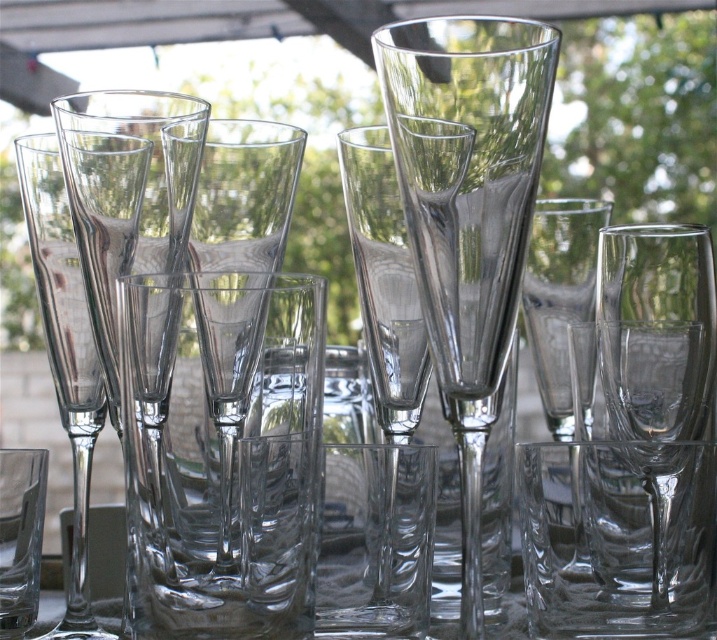
Question: Which is farther from the transparent glass vase at center?

Choices:
 (A) transparent glass wine glass at left
 (B) transparent glass flute at left
 (C) transparent glass wine glass at center

Answer: (B)

Question: Can you confirm if transparent glass wine glass at center is positioned to the right of transparent glass flute at left?

Choices:
 (A) yes
 (B) no

Answer: (A)

Question: Which object appears farthest from the camera in this image?

Choices:
 (A) transparent glass flute at left
 (B) transparent glass wine glass at center
 (C) transparent glass vase at center
 (D) transparent glass wine glass at left

Answer: (A)

Question: Considering the relative positions of transparent glass vase at center and transparent glass wine glass at left in the image provided, where is transparent glass vase at center located with respect to transparent glass wine glass at left?

Choices:
 (A) below
 (B) above

Answer: (A)

Question: Which object is farther from the camera taking this photo?

Choices:
 (A) transparent glass flute at left
 (B) transparent glass wine glass at left

Answer: (A)

Question: Is transparent glass wine glass at left further to the viewer compared to transparent glass flute at left?

Choices:
 (A) no
 (B) yes

Answer: (A)